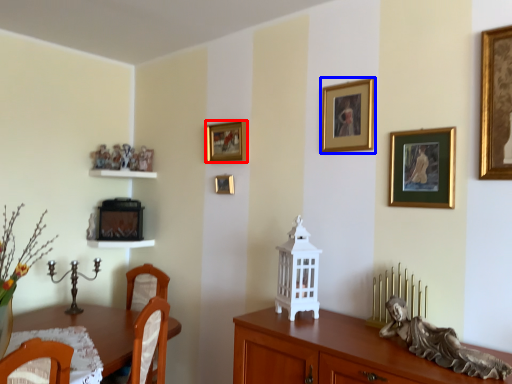
Question: Which of the following is the farthest to the observer, picture frame (highlighted by a red box) or picture frame (highlighted by a blue box)?

Choices:
 (A) picture frame
 (B) picture frame

Answer: (A)